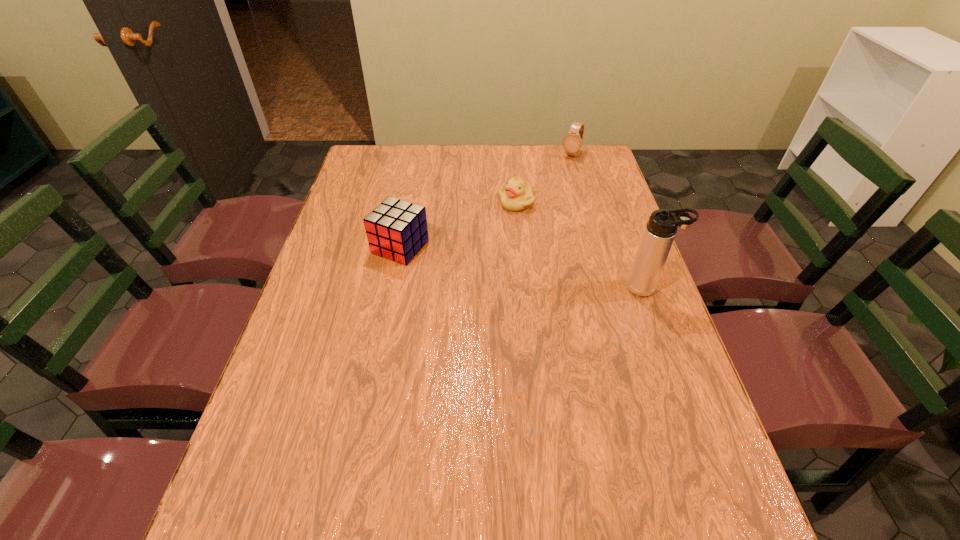
Where is `vacant position at the far edge of the desktop`? The image size is (960, 540). vacant position at the far edge of the desktop is located at coordinates (444, 167).

Where is `free space at the near edge of the desktop`? Image resolution: width=960 pixels, height=540 pixels. free space at the near edge of the desktop is located at coordinates (390, 490).

In the image, there is a desktop. In order to click on vacant region at the left edge in this screenshot , I will do `click(290, 330)`.

In the image, there is a desktop. Where is `free space at the right edge`? free space at the right edge is located at coordinates (588, 221).

The image size is (960, 540). In the image, there is a desktop. In order to click on vacant space at the far right corner in this screenshot , I will do `click(601, 158)`.

The width and height of the screenshot is (960, 540). I want to click on blank space at the near right corner, so click(640, 471).

This screenshot has width=960, height=540. In order to click on vacant area that lies between the third nearest object and the farthest object in this screenshot , I will do `click(543, 178)`.

The width and height of the screenshot is (960, 540). I want to click on free spot between the second object from left to right and the third farthest object, so click(458, 225).

At what (x,y) coordinates should I click in order to perform the action: click on empty space between the watch and the third object from right to left. Please return your answer as a coordinate pair (x, y). This screenshot has height=540, width=960. Looking at the image, I should click on (543, 178).

Identify the location of free spot between the third farthest object and the third object from left to right. (486, 201).